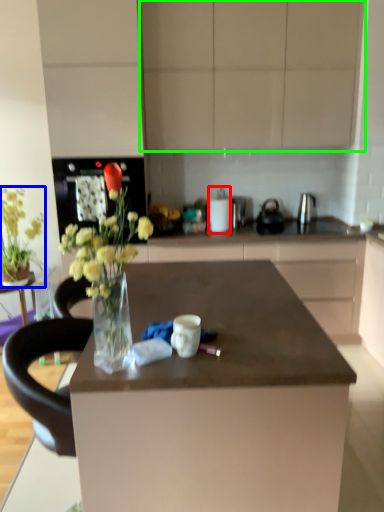
Question: Which object is positioned closest to appliance (highlighted by a red box)? Select from flower (highlighted by a blue box) and cabinetry (highlighted by a green box).

Choices:
 (A) flower
 (B) cabinetry

Answer: (B)